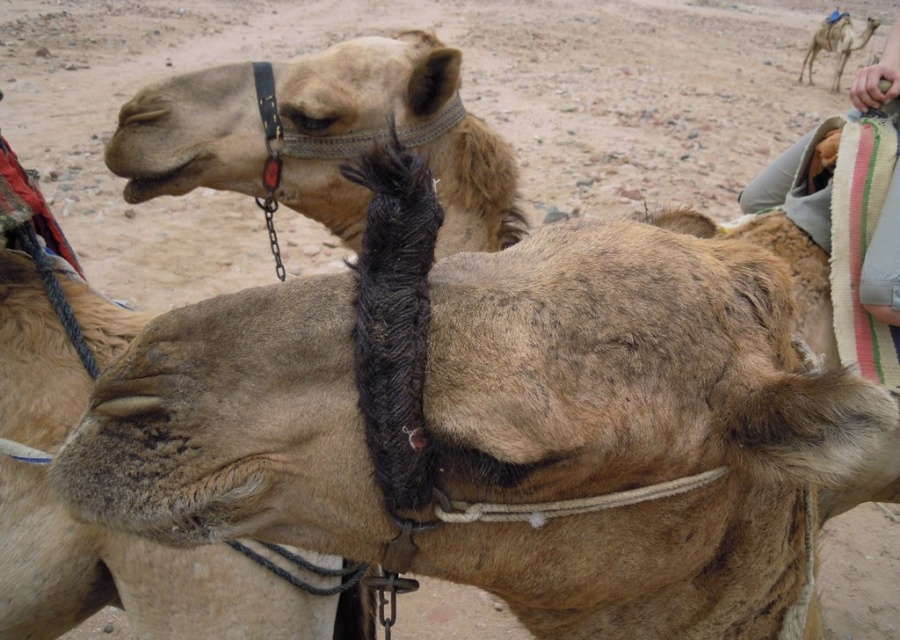
You are a photographer setting up a shot in a desert scene. You have a fuzzy beige camel at center and a striped fabric cushion at upper right. To ensure the cushion doesn not block the camel in your photo, where should you position your camera?

The fuzzy beige camel at center is positioned under the striped fabric cushion at upper right, so to avoid the cushion blocking the camel, you should position your camera so it captures the camel below the cushion or adjusts the angle so the cushion is above and not obscuring the camel.

Based on the scene description, where is the fuzzy beige camel at center located in terms of coordinates?

The fuzzy beige camel at center is located at point [135,579].